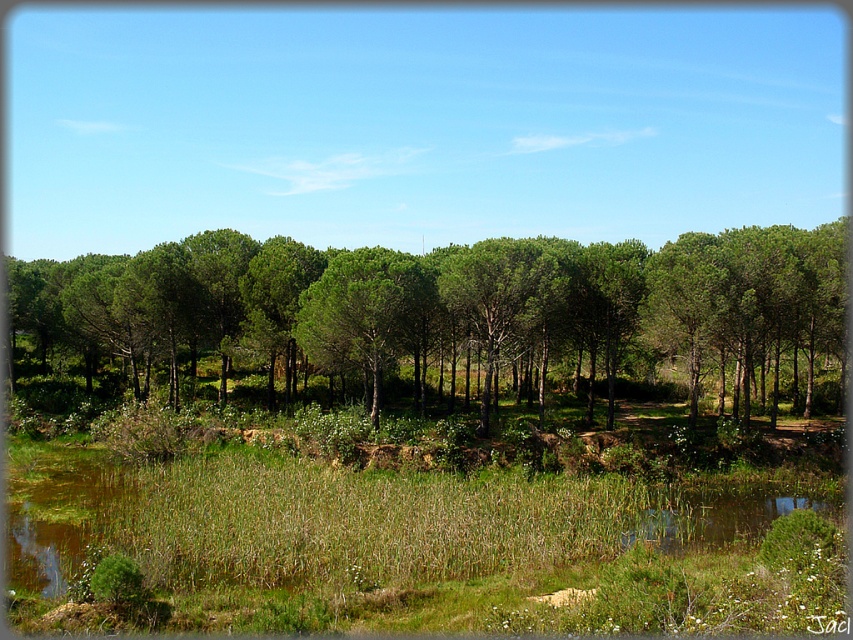
Between green leafy tree at center and green matte tree at center, which one is positioned lower?

green matte tree at center is below.

Does point (376, 372) come farther from viewer compared to point (352, 323)?

Yes, it is.

Where is `green leafy tree at center`? The width and height of the screenshot is (853, 640). green leafy tree at center is located at coordinates (447, 316).